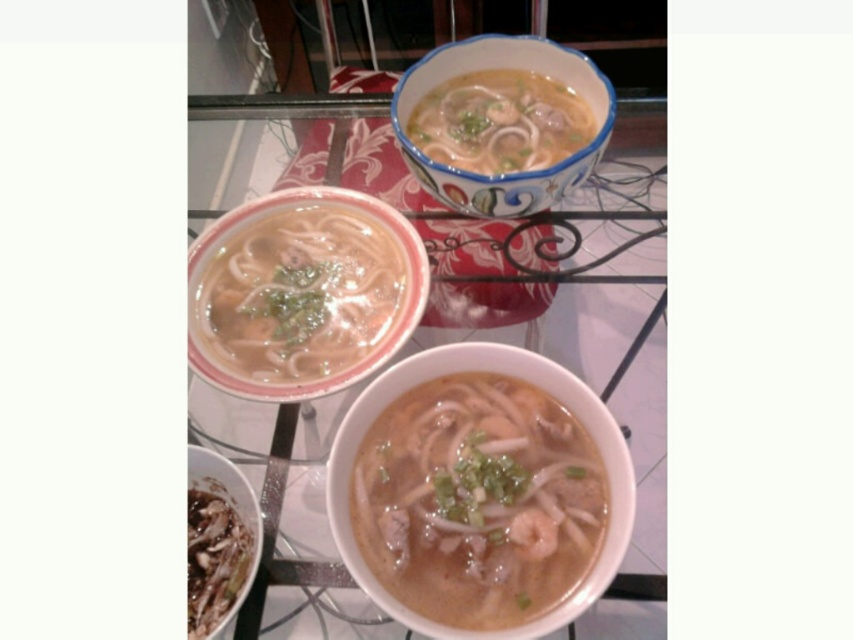
You are a food critic evaluating the presentation of two bowls of soup. The bowls are the white glossy bowl at center and the matte white bowl at center. Based on their height, which bowl would you recommend for serving a soup that requires a taller vessel to prevent spillage?

The matte white bowl at center is taller than the white glossy bowl at center, so it would be better suited for serving a soup that requires a taller vessel to prevent spillage.

You have two bowls on a table, a white glossy bowl at center and a matte white bowl at center. Which one is wider?

The matte white bowl at center is wider than the white glossy bowl at center.